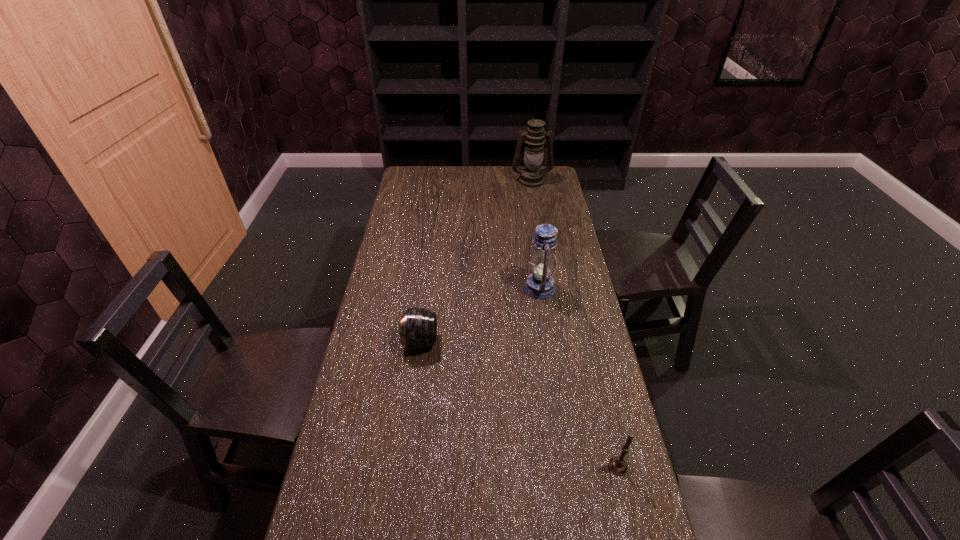
You are a GUI agent. You are given a task and a screenshot of the screen. Output one action in this format:
    pyautogui.click(x=<x>, y=<y>)
    Task: Click on the farthest object
    Image resolution: width=960 pixels, height=540 pixels.
    Given the screenshot: What is the action you would take?
    pyautogui.click(x=531, y=176)

Where is `the third nearest object`? The height and width of the screenshot is (540, 960). the third nearest object is located at coordinates (539, 284).

In order to click on the third tallest object in this screenshot , I will do `click(617, 465)`.

The width and height of the screenshot is (960, 540). I want to click on the nearest object, so click(x=617, y=465).

Where is `the shortest object`? the shortest object is located at coordinates (418, 328).

Identify the location of telephoto lens. This screenshot has height=540, width=960. (418, 328).

This screenshot has height=540, width=960. What are the coordinates of `free region located on the front of the oil lamp` in the screenshot? It's located at (534, 193).

Image resolution: width=960 pixels, height=540 pixels. Find the location of `free space located on the front-facing side of the third nearest object`. free space located on the front-facing side of the third nearest object is located at coordinates (453, 288).

In order to click on vacant space positioned on the front-facing side of the third nearest object in this screenshot , I will do [x=417, y=288].

Where is `free space located on the front-facing side of the third nearest object`? Image resolution: width=960 pixels, height=540 pixels. free space located on the front-facing side of the third nearest object is located at coordinates (414, 288).